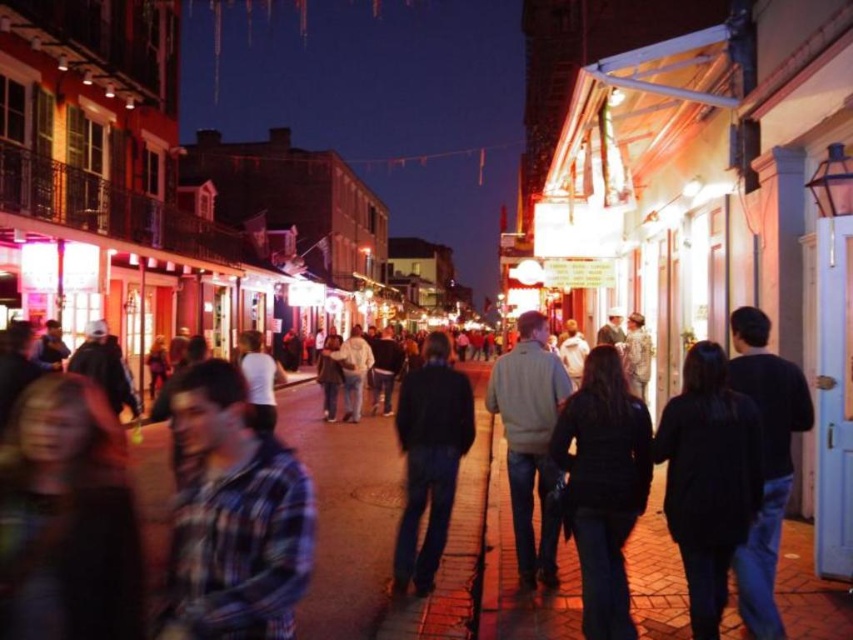
You are a fashion designer observing a pedestrian wearing a plaid fabric shirt at center and dark blue jeans at center. Which clothing item appears smaller in size?

The plaid fabric shirt at center has a smaller size compared to the dark blue jeans at center, so the plaid fabric shirt at center appears smaller in size.

You are a photographer standing on the street and want to take a photo of the plaid fabric shirt at center and the dark blue jeans at center. Which object should you focus on first to ensure both are in sharp focus?

You should focus on the plaid fabric shirt at center first because it is closer to the viewer than the dark blue jeans at center. By focusing on the closer object, the depth of field may extend to include the farther object in acceptable focus.